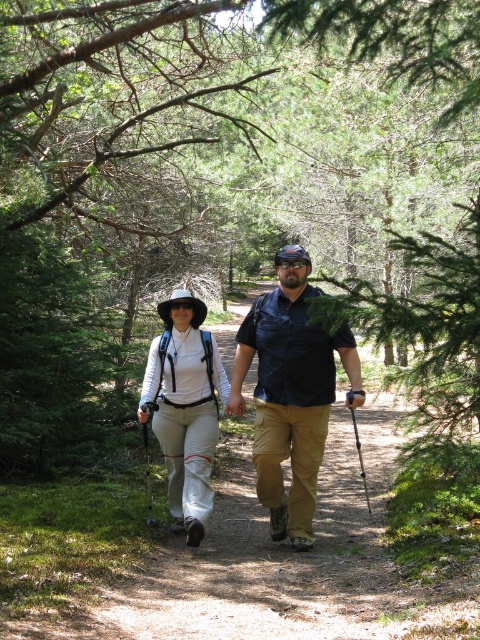
Question: From the image, what is the correct spatial relationship of matte blue shirt at center in relation to white fabric hat at center?

Choices:
 (A) below
 (B) above

Answer: (B)

Question: Which of the following is the closest to the observer?

Choices:
 (A) (180, 353)
 (B) (276, 412)

Answer: (B)

Question: Among these objects, which one is farthest from the camera?

Choices:
 (A) matte blue shirt at center
 (B) white fabric hat at center

Answer: (B)

Question: Can you confirm if matte blue shirt at center is wider than white fabric hat at center?

Choices:
 (A) yes
 (B) no

Answer: (A)

Question: Is matte blue shirt at center to the left of white fabric hat at center from the viewer's perspective?

Choices:
 (A) no
 (B) yes

Answer: (A)

Question: Which point is closer to the camera?

Choices:
 (A) matte blue shirt at center
 (B) white fabric hat at center

Answer: (A)